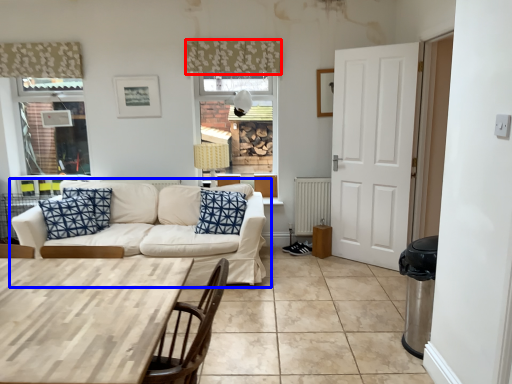
Question: Among these objects, which one is nearest to the camera, curtain (highlighted by a red box) or studio couch (highlighted by a blue box)?

Choices:
 (A) curtain
 (B) studio couch

Answer: (B)